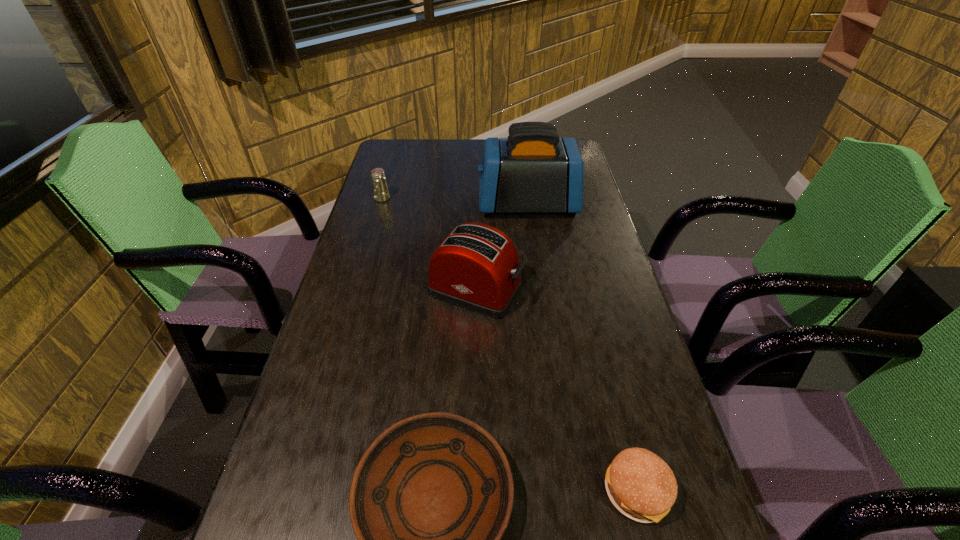
In order to click on vacant position in the image that satisfies the following two spatial constraints: 1. on the front side of the hamburger; 2. on the right side of the third shortest object in this screenshot , I will do `click(297, 491)`.